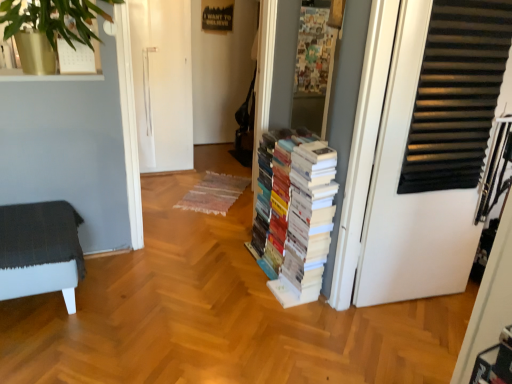
The width and height of the screenshot is (512, 384). Find the location of `empty space that is in between dark gray fabric ottoman at left and white paper books at center`. empty space that is in between dark gray fabric ottoman at left and white paper books at center is located at coordinates (170, 287).